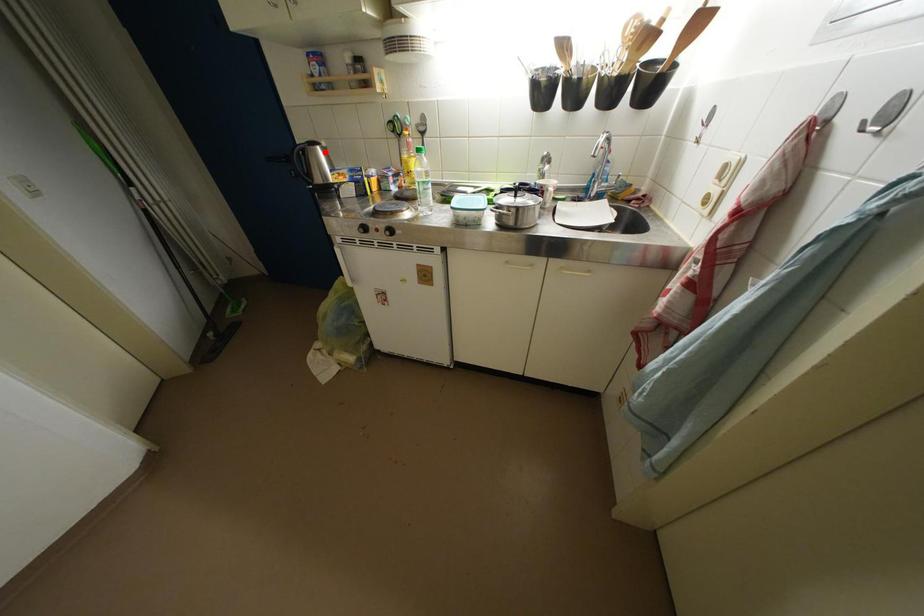
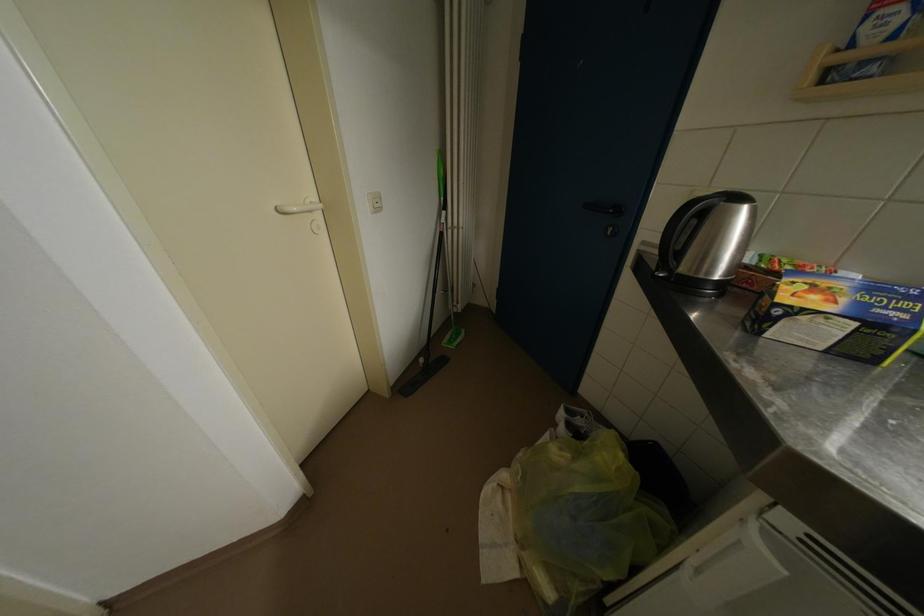
Question: I am providing you with two images of the same scene from different viewpoints. A red point is marked on the first image. At the location where the point appears in image 1, is it still visible in image 2?

Choices:
 (A) Yes
 (B) No

Answer: (A)